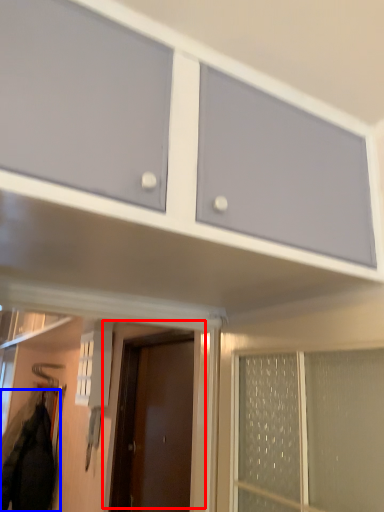
Question: Which point is further to the camera, door (highlighted by a red box) or jacket (highlighted by a blue box)?

Choices:
 (A) door
 (B) jacket

Answer: (B)